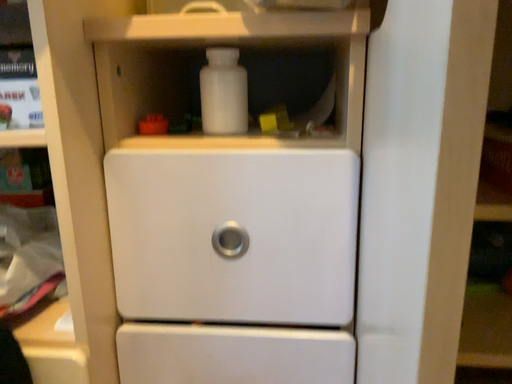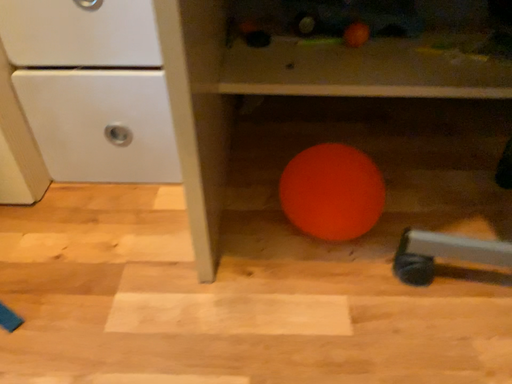
Question: Which way did the camera rotate in the video?

Choices:
 (A) rotated downward
 (B) rotated upward

Answer: (A)